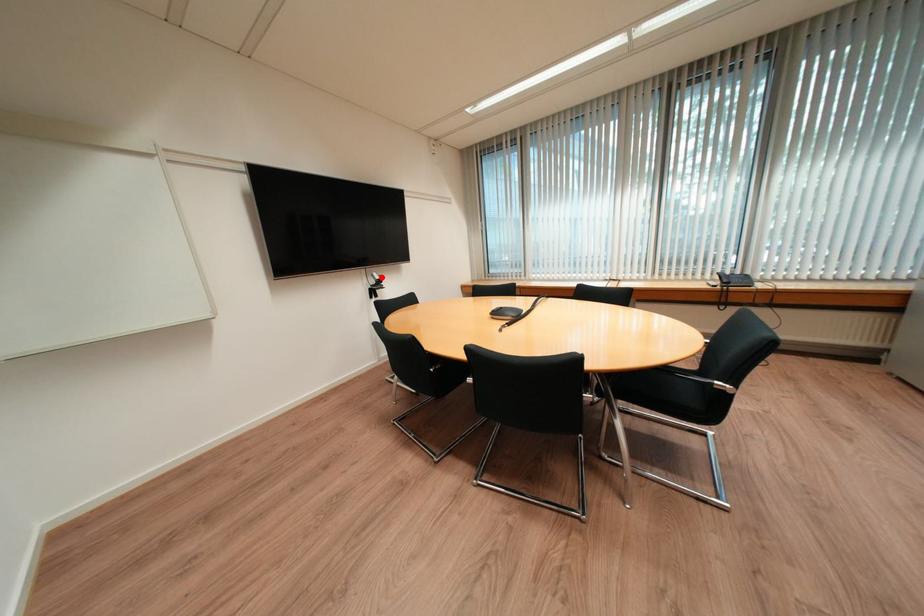
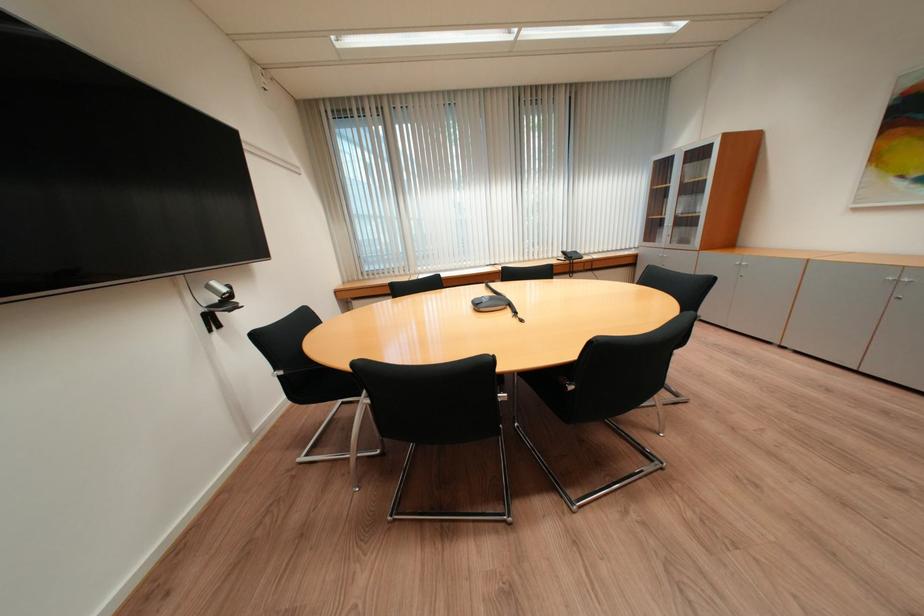
Where in the second image is the point corresponding to the highlighted location from the first image?

(217, 289)